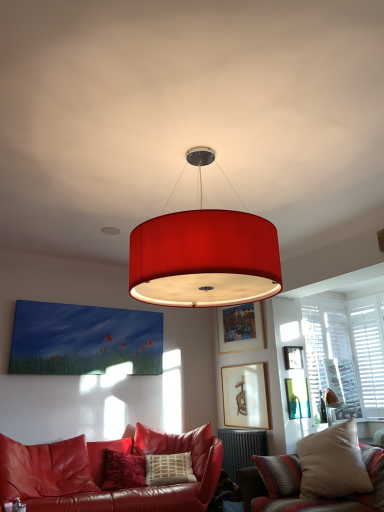
Question: Could matte wooden picture frame at center, which is counted as the 4th picture frame, starting from the top, be considered to be inside matte red drum shade at center?

Choices:
 (A) no
 (B) yes

Answer: (A)

Question: Considering the relative sizes of matte red drum shade at center and matte wooden picture frame at center, the 1th picture frame in the bottom-to-top sequence, in the image provided, is matte red drum shade at center smaller than matte wooden picture frame at center, the 1th picture frame in the bottom-to-top sequence,?

Choices:
 (A) yes
 (B) no

Answer: (B)

Question: Are matte red drum shade at center and matte wooden picture frame at center, which is counted as the 4th picture frame, starting from the top, far apart?

Choices:
 (A) no
 (B) yes

Answer: (B)

Question: Considering the relative sizes of matte red drum shade at center and matte wooden picture frame at center, the 1th picture frame in the bottom-to-top sequence, in the image provided, is matte red drum shade at center wider than matte wooden picture frame at center, the 1th picture frame in the bottom-to-top sequence,?

Choices:
 (A) no
 (B) yes

Answer: (B)

Question: Are matte red drum shade at center and matte wooden picture frame at center, which is counted as the 4th picture frame, starting from the top, making contact?

Choices:
 (A) no
 (B) yes

Answer: (A)

Question: Is point (x=296, y=397) closer or farther from the camera than point (x=206, y=293)?

Choices:
 (A) farther
 (B) closer

Answer: (A)

Question: In terms of width, does matte gold picture frame at upper right, which is the 2th picture frame from bottom to top, look wider or thinner when compared to matte red drum shade at center?

Choices:
 (A) wide
 (B) thin

Answer: (B)

Question: In terms of size, does matte gold picture frame at upper right, the 3th picture frame when ordered from top to bottom, appear bigger or smaller than matte red drum shade at center?

Choices:
 (A) small
 (B) big

Answer: (A)

Question: From a real-world perspective, relative to matte red drum shade at center, is matte gold picture frame at upper right, the 3th picture frame when ordered from top to bottom, vertically above or below?

Choices:
 (A) above
 (B) below

Answer: (B)

Question: From the image's perspective, is white wooden shutters at right located above or below dark gray metallic radiator at lower center?

Choices:
 (A) above
 (B) below

Answer: (A)

Question: Considering the positions of white wooden shutters at right and dark gray metallic radiator at lower center in the image, is white wooden shutters at right taller or shorter than dark gray metallic radiator at lower center?

Choices:
 (A) short
 (B) tall

Answer: (B)

Question: In terms of width, does white wooden shutters at right look wider or thinner when compared to dark gray metallic radiator at lower center?

Choices:
 (A) thin
 (B) wide

Answer: (A)

Question: Relative to dark gray metallic radiator at lower center, is white wooden shutters at right in front or behind?

Choices:
 (A) front
 (B) behind

Answer: (B)

Question: Do you think wooden picture frame at upper center, which is the third picture frame in bottom-to-top order, is within matte wooden picture frame at center, which is counted as the 4th picture frame, starting from the top, or outside of it?

Choices:
 (A) inside
 (B) outside

Answer: (B)

Question: Considering the positions of point (291, 358) and point (228, 376), is point (291, 358) closer or farther from the camera than point (228, 376)?

Choices:
 (A) closer
 (B) farther

Answer: (A)